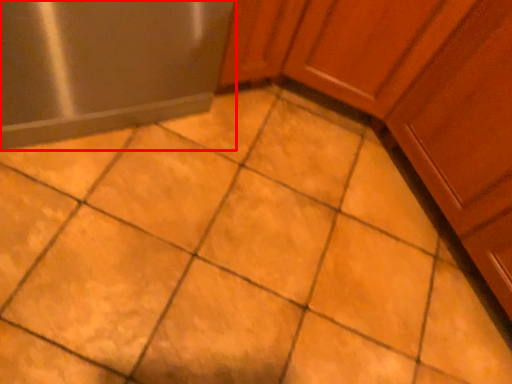
Question: From the image's perspective, considering the relative positions of appliance (annotated by the red box) and cabinetry in the image provided, where is appliance (annotated by the red box) located with respect to the staircase?

Choices:
 (A) below
 (B) above

Answer: (B)